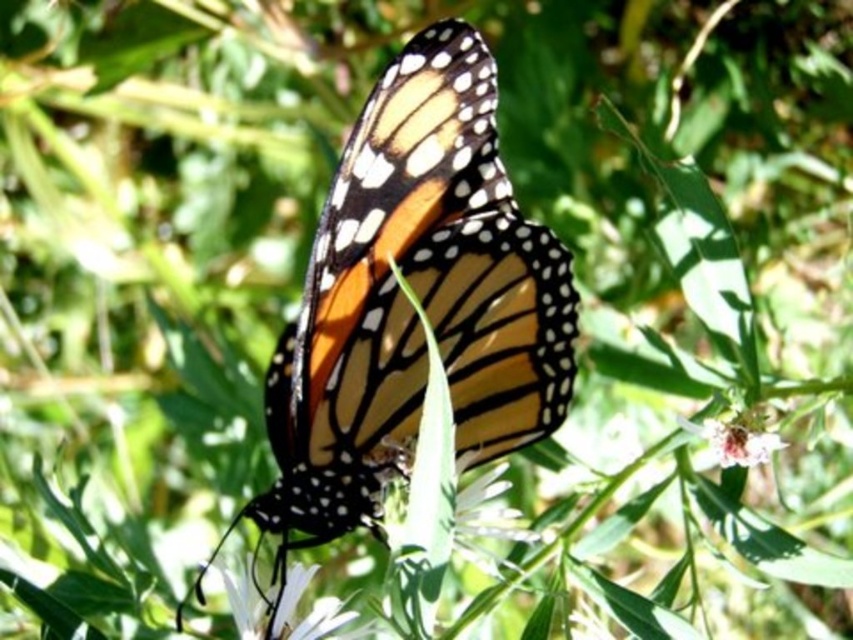
Question: Which point is closer to the camera taking this photo?

Choices:
 (A) (466, 556)
 (B) (306, 614)
 (C) (767, 435)

Answer: (B)

Question: Among these objects, which one is nearest to the camera?

Choices:
 (A) white fuzzy flower at center
 (B) orange and black spotted butterfly at center
 (C) white matte flower at lower center

Answer: (C)

Question: Is orange and black spotted butterfly at center positioned behind white fuzzy flower at center?

Choices:
 (A) yes
 (B) no

Answer: (B)

Question: Where is white matte flower at lower center located in relation to white textured flower at center in the image?

Choices:
 (A) right
 (B) left

Answer: (B)

Question: Does orange and black spotted butterfly at center have a lesser width compared to white textured flower at center?

Choices:
 (A) no
 (B) yes

Answer: (A)

Question: Which object is positioned farthest from the white fuzzy flower at center?

Choices:
 (A) white textured flower at center
 (B) orange and black spotted butterfly at center

Answer: (B)